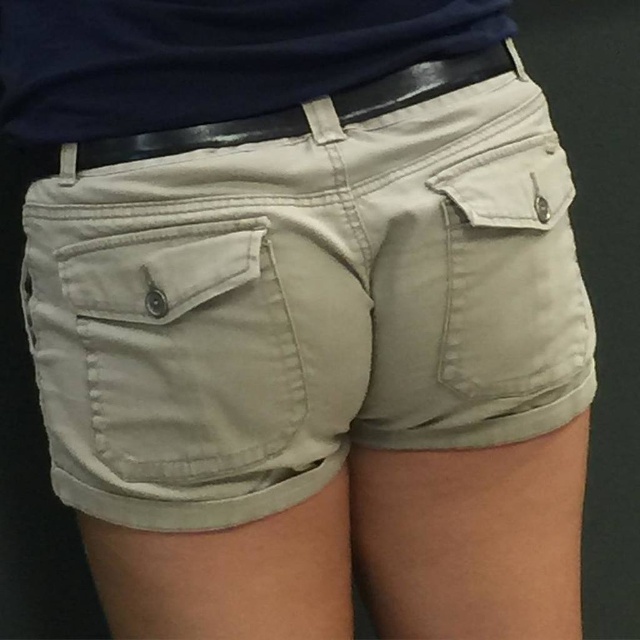
You are a tailor measuring a customer for a new belt. You notice the light beige cotton pocket at lower center and the black leather belt at upper center. Which item is located below the other?

The light beige cotton pocket at lower center is positioned under the black leather belt at upper center, so the pocket is below the belt.